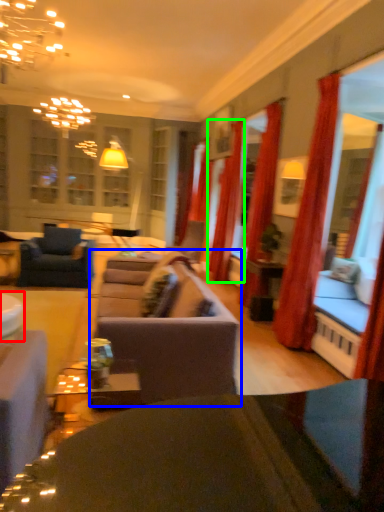
Question: Which object is positioned farthest from table (highlighted by a red box)? Select from studio couch (highlighted by a blue box) and curtain (highlighted by a green box).

Choices:
 (A) studio couch
 (B) curtain

Answer: (B)